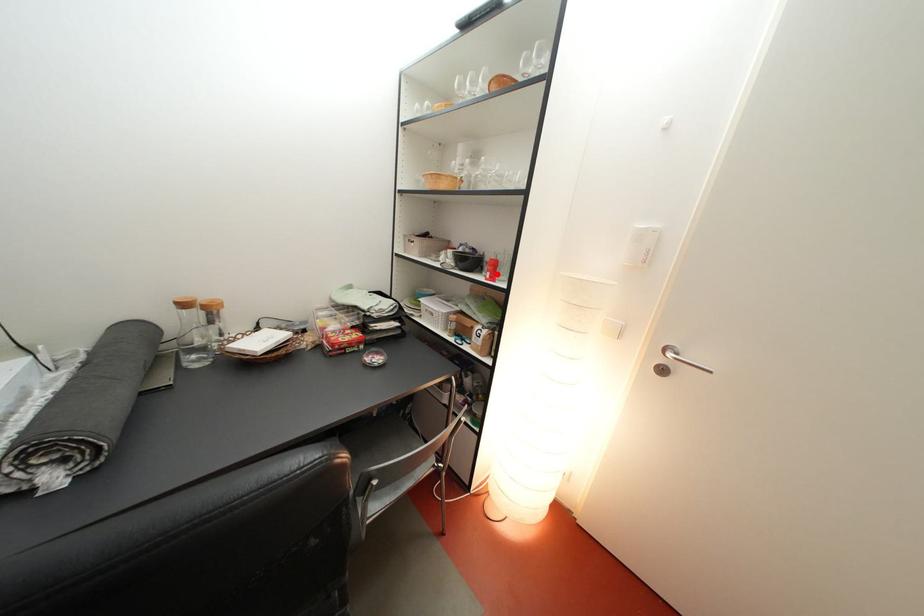
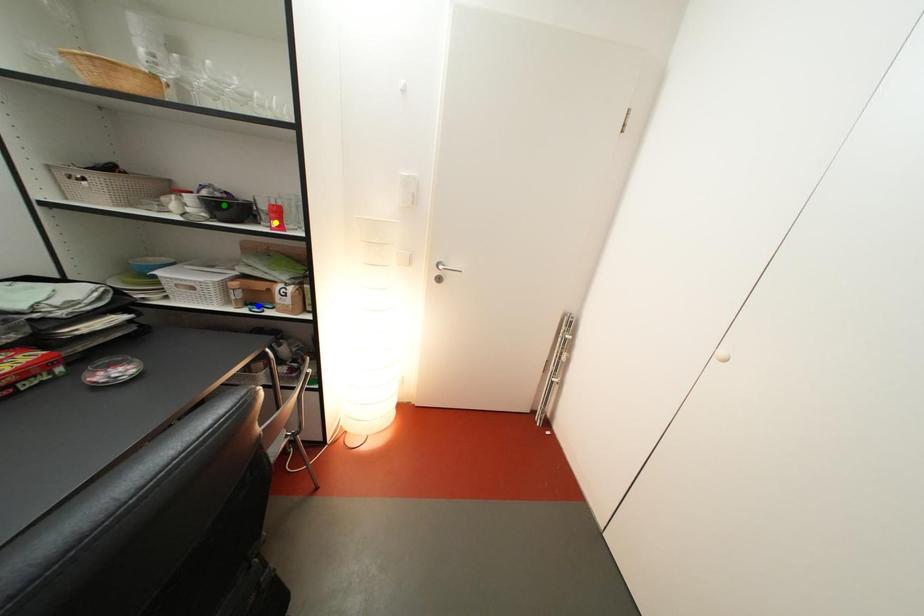
Question: I am providing you with two images of the same scene from different viewpoints. A red point is marked on the first image. You are given multiple points on the second image. Can you choose the point in image 2 that corresponds to the point in image 1?

Choices:
 (A) blue point
 (B) yellow point
 (C) green point

Answer: (B)